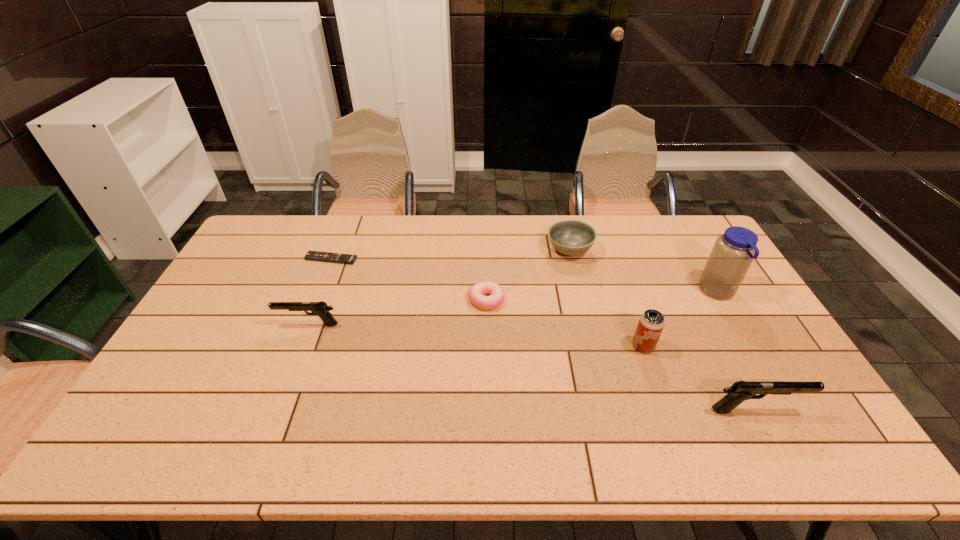
Identify the location of beer can. This screenshot has width=960, height=540. (651, 323).

Image resolution: width=960 pixels, height=540 pixels. Find the location of `the third object from right to left`. the third object from right to left is located at coordinates (651, 323).

Where is `free space located 0.180m at the aiming end of the fifth farthest object`? The image size is (960, 540). free space located 0.180m at the aiming end of the fifth farthest object is located at coordinates (218, 325).

The width and height of the screenshot is (960, 540). What are the coordinates of `free space located at the aiming end of the fifth farthest object` in the screenshot? It's located at (225, 325).

I want to click on free space located 0.160m at the aiming end of the fifth farthest object, so click(225, 325).

I want to click on vacant space located on the front of the fourth object from left to right, so click(x=575, y=275).

Locate an element on the screen. This screenshot has width=960, height=540. vacant region located 0.210m with a carrying loop on the side of the water bottle is located at coordinates (635, 292).

At what (x,y) coordinates should I click in order to perform the action: click on vacant space situated with a carrying loop on the side of the water bottle. Please return your answer as a coordinate pair (x, y). Looking at the image, I should click on (610, 292).

I want to click on free space located 0.090m with a carrying loop on the side of the water bottle, so click(672, 292).

At what (x,y) coordinates should I click in order to perform the action: click on free space located on the right of the remote control. Please return your answer as a coordinate pair (x, y). The image size is (960, 540). Looking at the image, I should click on (415, 259).